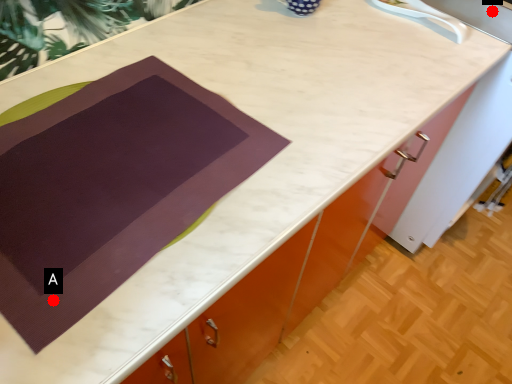
Question: Two points are circled on the image, labeled by A and B beside each circle. Which point is farther to the camera?

Choices:
 (A) A is further
 (B) B is further

Answer: (B)